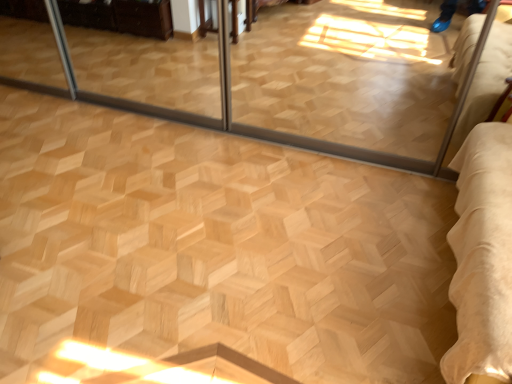
Where is `empty space that is ontop of natural wood parquet floor at center (from a real-world perspective)`? empty space that is ontop of natural wood parquet floor at center (from a real-world perspective) is located at coordinates (162, 203).